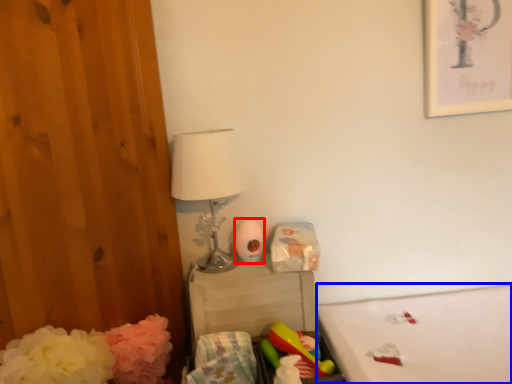
Question: Which of the following is the closest to the observer, toilet paper (highlighted by a red box) or mattress (highlighted by a blue box)?

Choices:
 (A) toilet paper
 (B) mattress

Answer: (B)